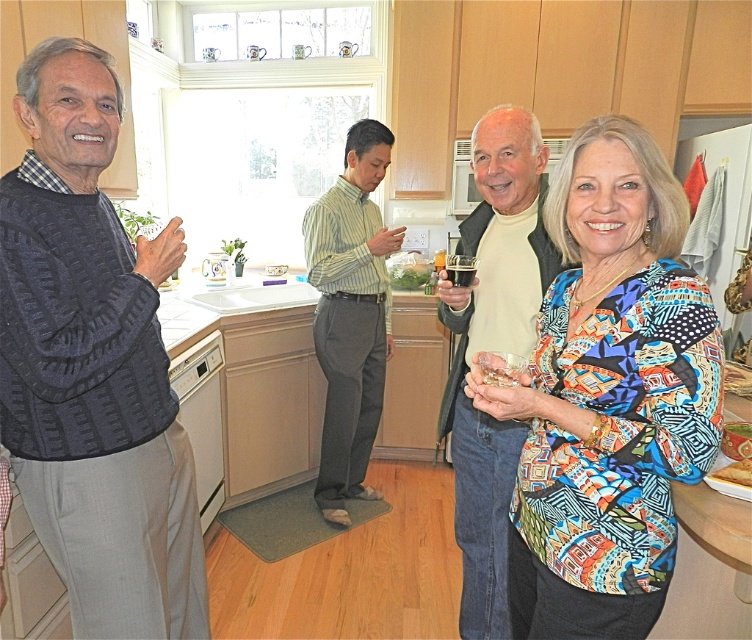
You are at a party and want to introduce yourself to both the person wearing the light beige sweater at center and the person wearing the green striped shirt at center. If you start from the left side of the image, which person should you approach first?

The green striped shirt at center is to the left of the light beige sweater at center, so you should approach the person wearing the green striped shirt at center first when starting from the left side of the image.

You are trying to place a new kitchen appliance that requires a height clearance of 1.8 meters. Given the white plastic dishwasher at lower left and the translucent glass at center, which object is more likely to meet the height requirement?

The white plastic dishwasher at lower left is much taller than the translucent glass at center, so it is more likely to meet the height requirement of 1.8 meters.